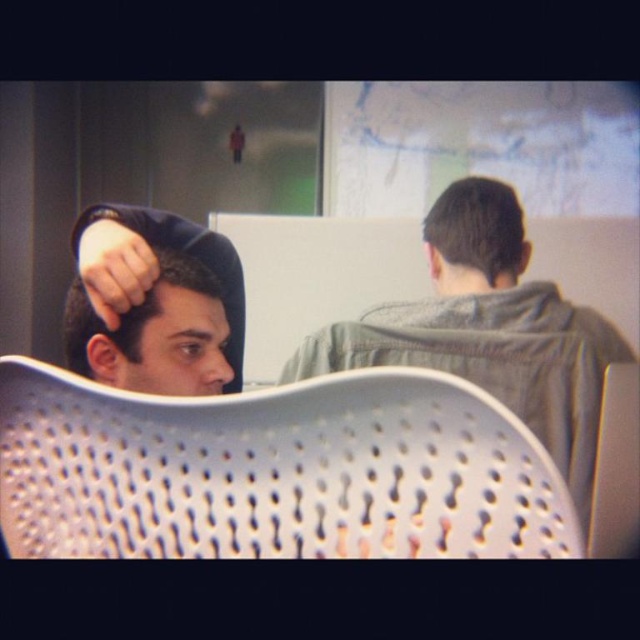
Question: Which point appears closest to the camera in this image?

Choices:
 (A) (449, 208)
 (B) (77, 298)
 (C) (410, 509)

Answer: (C)

Question: Considering the real-world distances, which object is closest to the white perforated chair at center?

Choices:
 (A) matte black hair at left
 (B) gray fabric jacket at upper right

Answer: (A)

Question: From the image, what is the correct spatial relationship of white perforated chair at center in relation to gray fabric jacket at upper right?

Choices:
 (A) left
 (B) right

Answer: (A)

Question: Which point is farther from the camera taking this photo?

Choices:
 (A) (472, 416)
 (B) (420, 326)
 (C) (170, 330)

Answer: (B)

Question: Can you confirm if gray fabric jacket at upper right is smaller than matte black hair at left?

Choices:
 (A) yes
 (B) no

Answer: (B)

Question: Is white perforated chair at center smaller than gray fabric jacket at upper right?

Choices:
 (A) no
 (B) yes

Answer: (B)